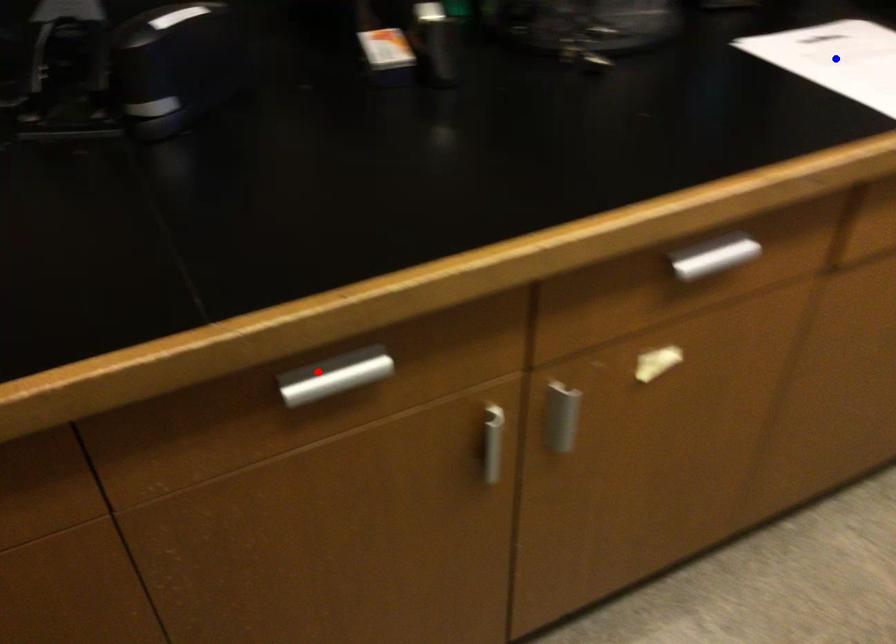
Question: In the image, two points are highlighted. Which point is nearer to the camera? Reply with the corresponding letter.

Choices:
 (A) blue point
 (B) red point

Answer: (B)